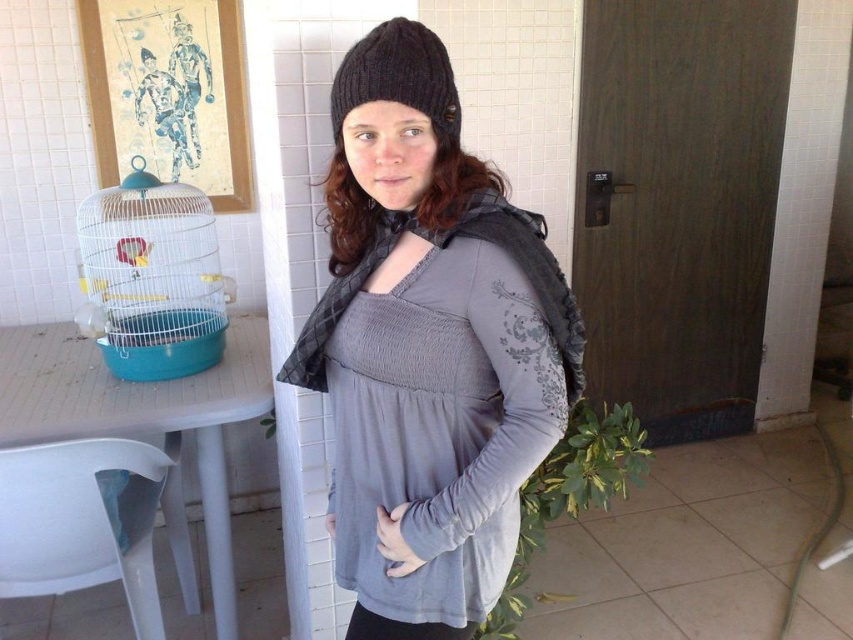
Which is below, knitted dark gray beanie at center or black knitted beanie at upper center?

knitted dark gray beanie at center is below.

Is point (461, 211) more distant than point (380, 36)?

Yes, it is behind point (380, 36).

What do you see at coordinates (428, 348) in the screenshot?
I see `knitted dark gray beanie at center` at bounding box center [428, 348].

You are a GUI agent. You are given a task and a screenshot of the screen. Output one action in this format:
    pyautogui.click(x=<x>, y=<y>)
    Task: Click on the knitted dark gray beanie at center
    This screenshot has height=640, width=853.
    Given the screenshot: What is the action you would take?
    pyautogui.click(x=428, y=348)

Who is positioned more to the left, knitted dark gray beanie at center or white plastic chair at lower left?

white plastic chair at lower left is more to the left.

Which is behind, point (343, 529) or point (109, 502)?

The point (109, 502) is behind.

Does point (432, 214) lie behind point (45, 589)?

That is False.

You are a GUI agent. You are given a task and a screenshot of the screen. Output one action in this format:
    pyautogui.click(x=<x>, y=<y>)
    Task: Click on the knitted dark gray beanie at center
    The width and height of the screenshot is (853, 640).
    Given the screenshot: What is the action you would take?
    pyautogui.click(x=428, y=348)

Is point (131, 278) positioned in front of point (349, 83)?

No, it is behind (349, 83).

Does blue wire birdcage at left have a greater height compared to black knitted beanie at upper center?

Correct, blue wire birdcage at left is much taller as black knitted beanie at upper center.

The image size is (853, 640). Describe the element at coordinates (151, 276) in the screenshot. I see `blue wire birdcage at left` at that location.

At what (x,y) coordinates should I click in order to perform the action: click on blue wire birdcage at left. Please return your answer as a coordinate pair (x, y). The image size is (853, 640). Looking at the image, I should click on (151, 276).